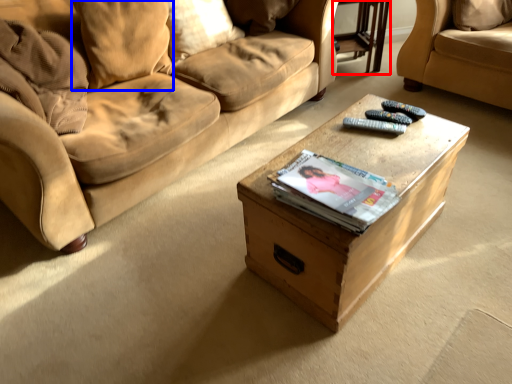
Question: Which of the following is the closest to the observer, glass table (highlighted by a red box) or pillow (highlighted by a blue box)?

Choices:
 (A) glass table
 (B) pillow

Answer: (B)